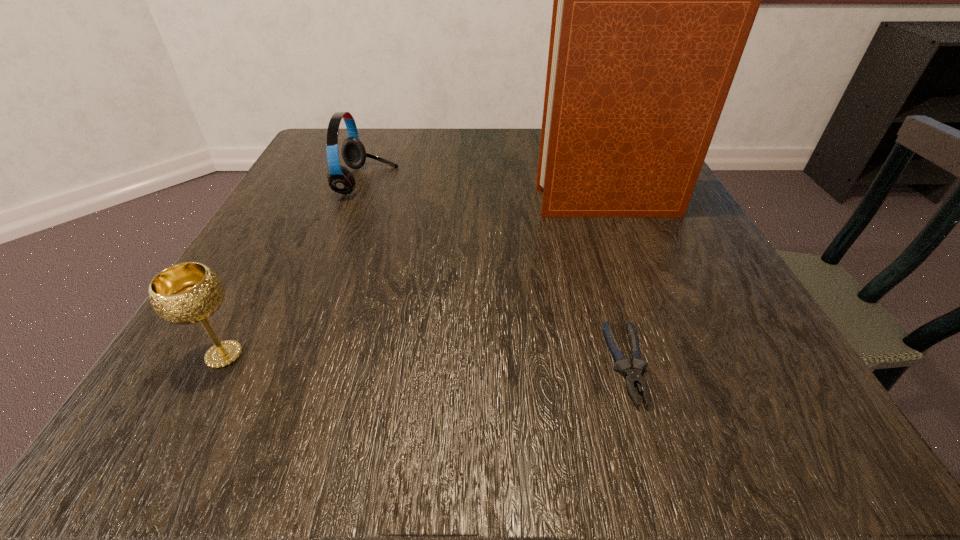
The height and width of the screenshot is (540, 960). In order to click on the tallest object in this screenshot , I will do `click(654, 0)`.

The width and height of the screenshot is (960, 540). I want to click on headset, so 341,180.

This screenshot has height=540, width=960. I want to click on the leftmost object, so click(x=186, y=293).

Identify the location of pliers. 633,376.

Locate an element on the screen. The width and height of the screenshot is (960, 540). blank space located 0.330m on the open cover of the hardback book is located at coordinates (361, 203).

The height and width of the screenshot is (540, 960). What are the coordinates of `vacant space located 0.190m on the open cover of the hardback book` in the screenshot? It's located at (436, 203).

Find the location of a particular element. The width and height of the screenshot is (960, 540). free space located on the open cover of the hardback book is located at coordinates (382, 203).

You are a GUI agent. You are given a task and a screenshot of the screen. Output one action in this format:
    pyautogui.click(x=<x>, y=<y>)
    Task: Click on the vacant region located 0.180m with the microphone attached to the side of the headset
    Image resolution: width=960 pixels, height=540 pixels.
    Given the screenshot: What is the action you would take?
    pyautogui.click(x=486, y=181)

The width and height of the screenshot is (960, 540). Find the location of `free point located 0.090m on the back of the leftmost object`. free point located 0.090m on the back of the leftmost object is located at coordinates (260, 287).

The height and width of the screenshot is (540, 960). What are the coordinates of `object that is at the far edge` in the screenshot? It's located at (341, 180).